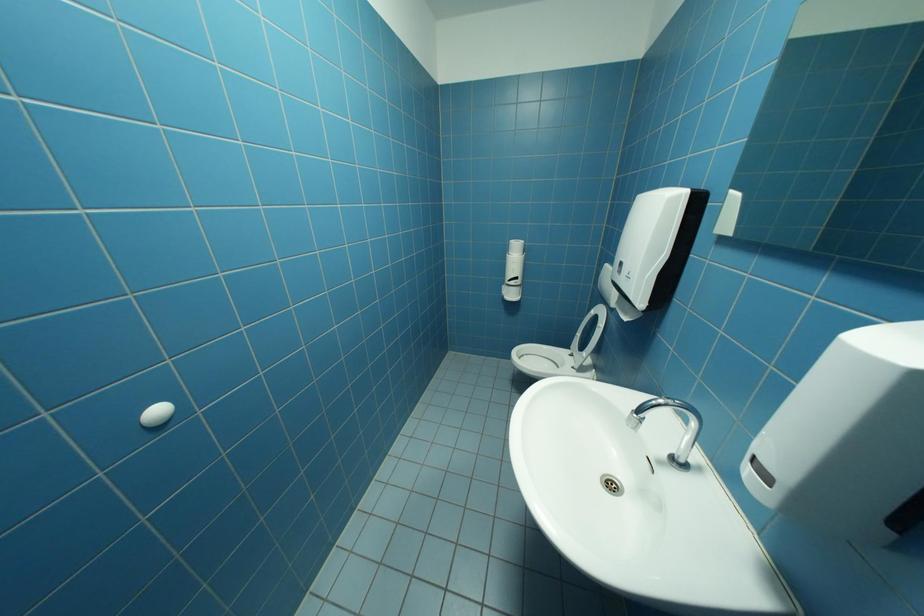
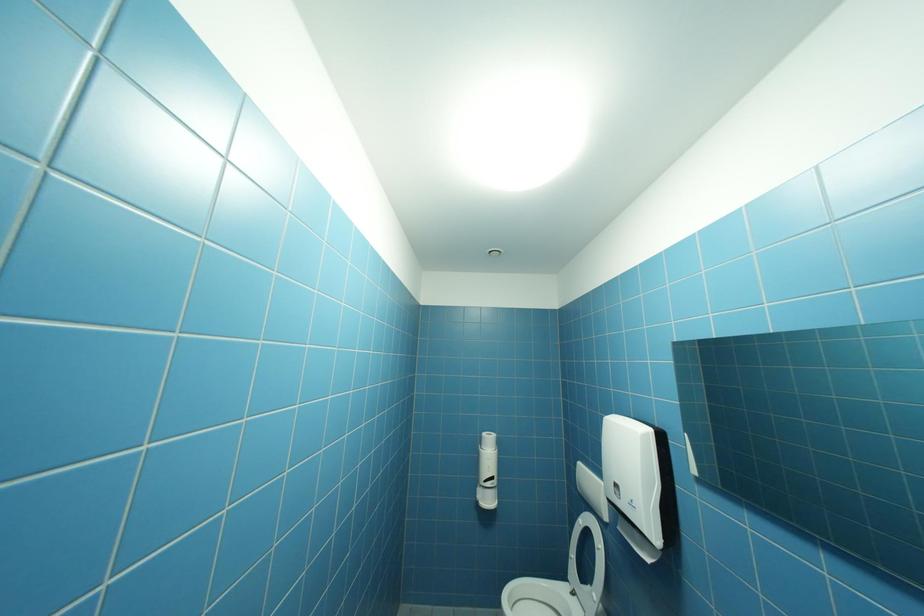
How did the camera likely rotate?

The camera rotated toward right-up.